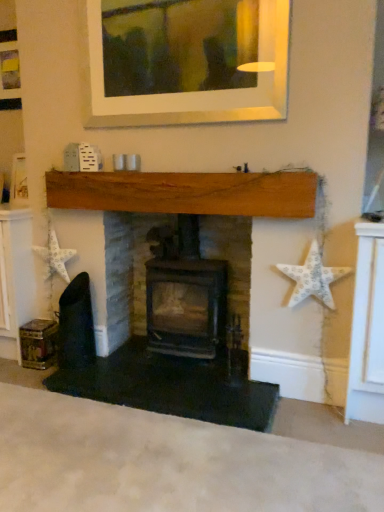
What are the coordinates of `free point below white textured star at right, which is the second starfish in left-to-right order (from a real-world perspective)` in the screenshot? It's located at point(309,393).